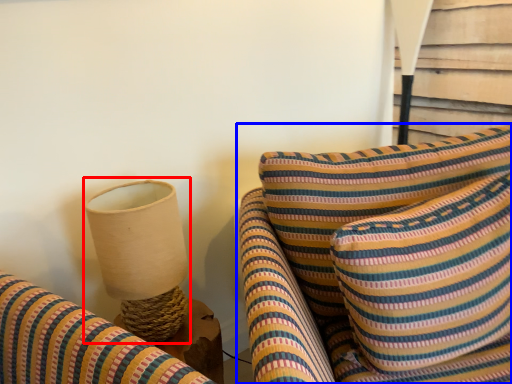
Question: Which point is further to the camera, table lamp (highlighted by a red box) or furniture (highlighted by a blue box)?

Choices:
 (A) table lamp
 (B) furniture

Answer: (A)